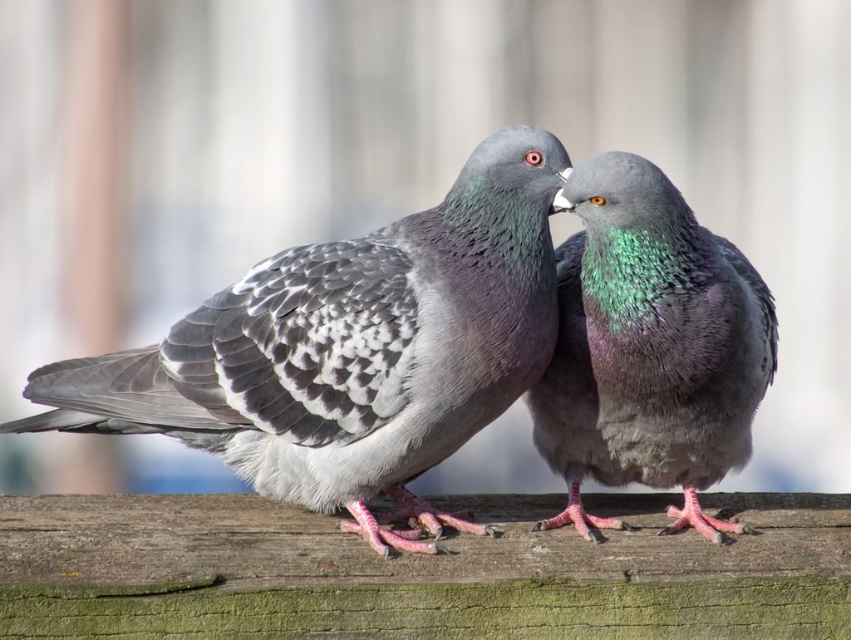
Question: Among these points, which one is nearest to the camera?

Choices:
 (A) (710, 253)
 (B) (250, 289)

Answer: (B)

Question: Can you confirm if gray speckled feathers at center is thinner than shiny green feathers at center?

Choices:
 (A) no
 (B) yes

Answer: (A)

Question: Is gray speckled feathers at center smaller than shiny green feathers at center?

Choices:
 (A) no
 (B) yes

Answer: (A)

Question: Among these points, which one is nearest to the camera?

Choices:
 (A) (709, 404)
 (B) (415, 516)

Answer: (A)

Question: Does gray speckled feathers at center lie behind shiny green feathers at center?

Choices:
 (A) no
 (B) yes

Answer: (A)